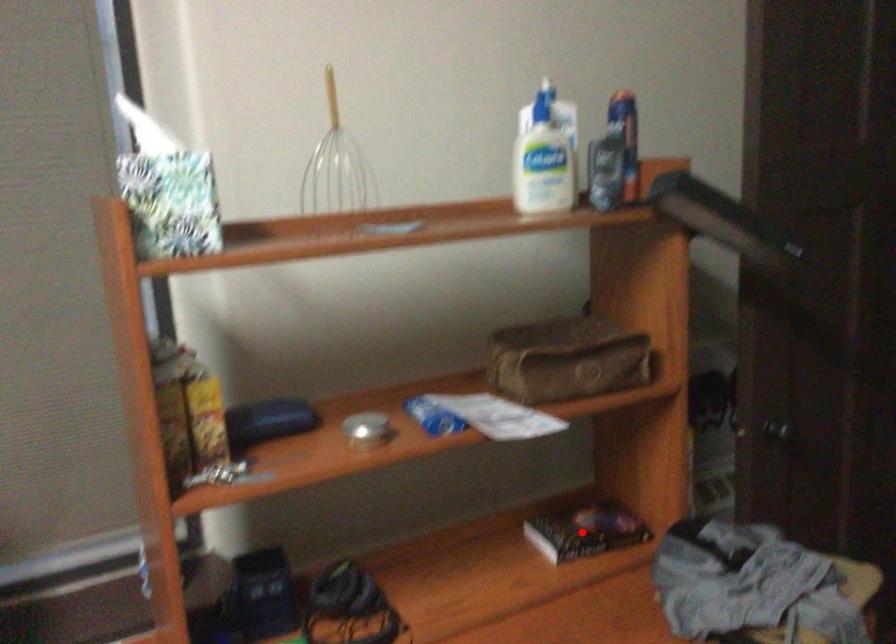
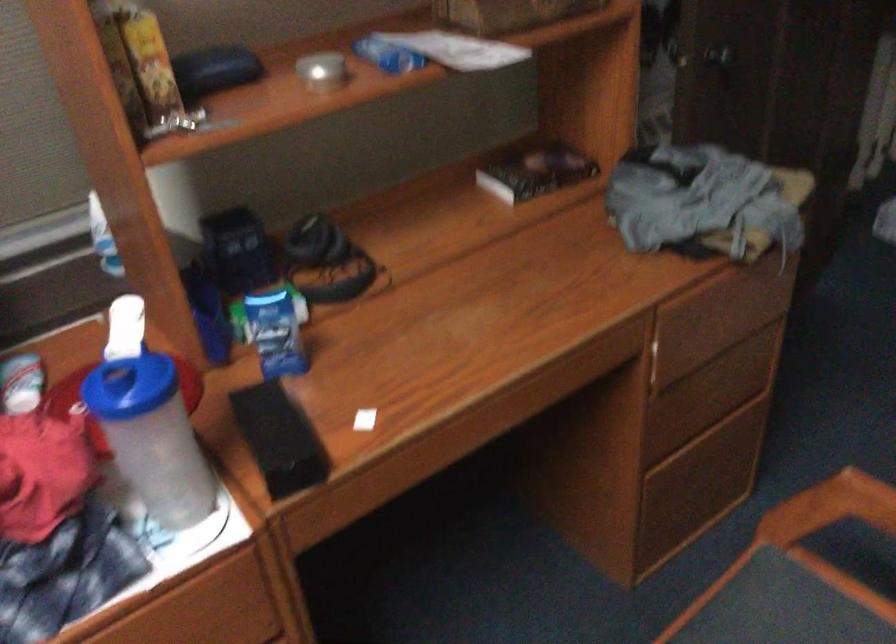
Locate, in the second image, the point that corresponds to the highlighted location in the first image.

(536, 172)